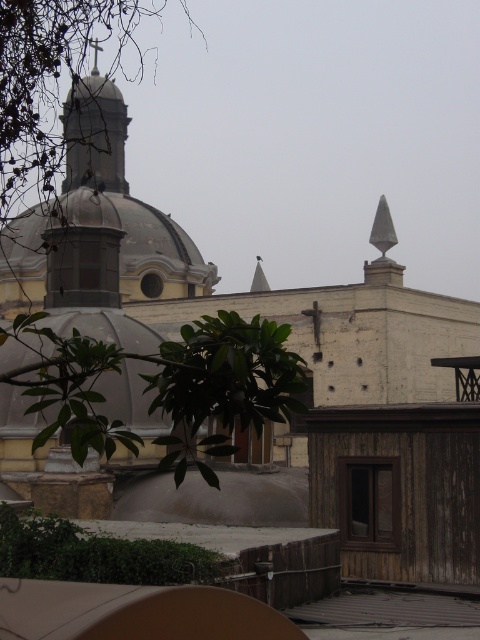
Question: Does gray stone dome at upper left have a lesser width compared to green leafy tree at center?

Choices:
 (A) no
 (B) yes

Answer: (A)

Question: Where is gray stone dome at upper left located in relation to green leafy tree at center in the image?

Choices:
 (A) left
 (B) right

Answer: (A)

Question: Can you confirm if gray stone dome at upper left is smaller than green leafy tree at center?

Choices:
 (A) no
 (B) yes

Answer: (A)

Question: Which point is farther from the camera taking this photo?

Choices:
 (A) [x=149, y=248]
 (B) [x=207, y=465]

Answer: (A)